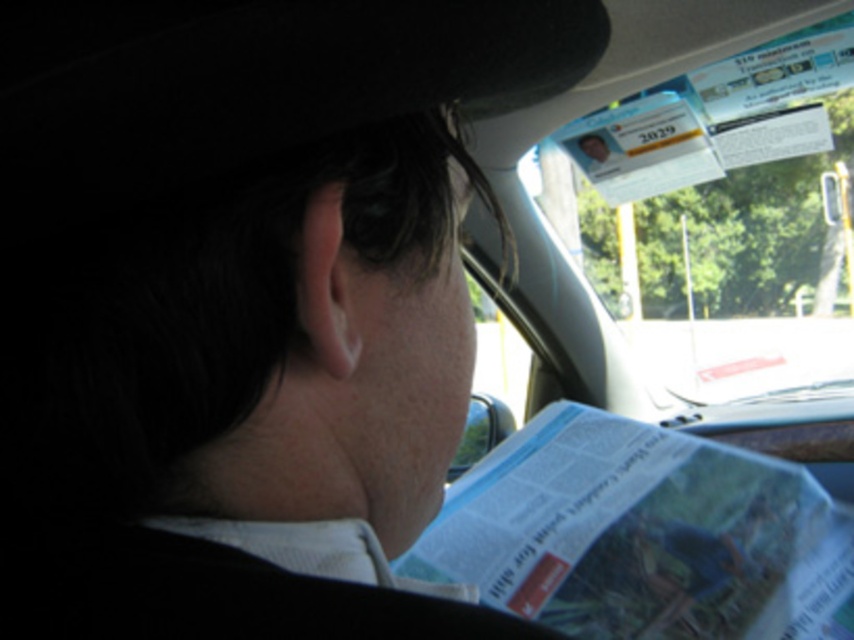
You are inside a car and see a point at coordinates (642, 534). What object is located at that point?

The point at coordinates (642, 534) corresponds to the white glossy paper at lower center.

You are inside a car and want to know which of the two points, point (664,483) or point (788,380), is closer to you. Based on the scene description, which point is nearer?

Point (664,483) is closer to the camera than point (788,380), so it is nearer to you.